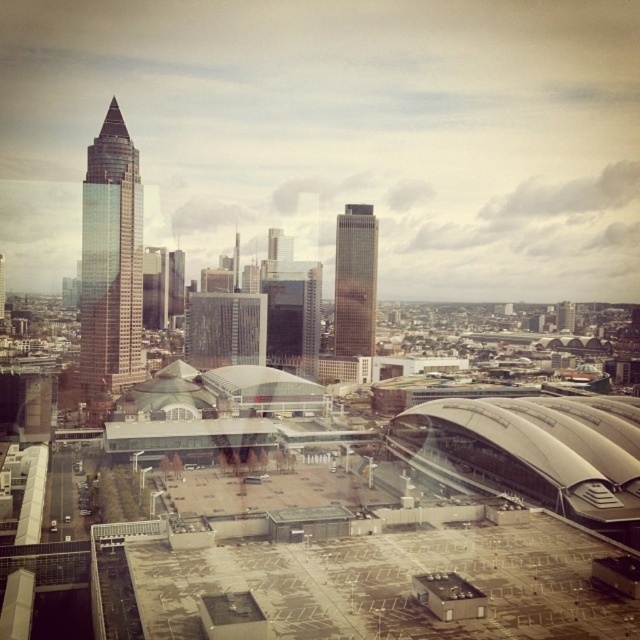
Question: Does shiny glass skyscraper at left appear on the left side of gold reflective skyscraper at center?

Choices:
 (A) no
 (B) yes

Answer: (B)

Question: Which point appears closest to the camera in this image?

Choices:
 (A) click(369, 241)
 (B) click(129, 280)

Answer: (B)

Question: Can you confirm if shiny glass skyscraper at left is positioned above gold reflective skyscraper at center?

Choices:
 (A) yes
 (B) no

Answer: (A)

Question: Which of the following is the farthest from the observer?

Choices:
 (A) (129, 348)
 (B) (342, 237)

Answer: (B)

Question: Is shiny glass skyscraper at left smaller than gold reflective skyscraper at center?

Choices:
 (A) yes
 (B) no

Answer: (B)

Question: Which object appears farthest from the camera in this image?

Choices:
 (A) shiny glass skyscraper at left
 (B) gold reflective skyscraper at center

Answer: (B)